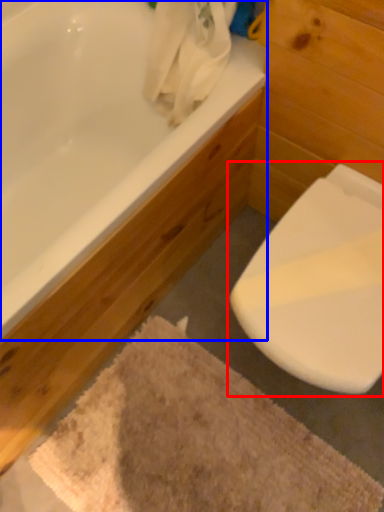
Question: Which object is further to the camera taking this photo, toilet (highlighted by a red box) or bathtub (highlighted by a blue box)?

Choices:
 (A) toilet
 (B) bathtub

Answer: (A)